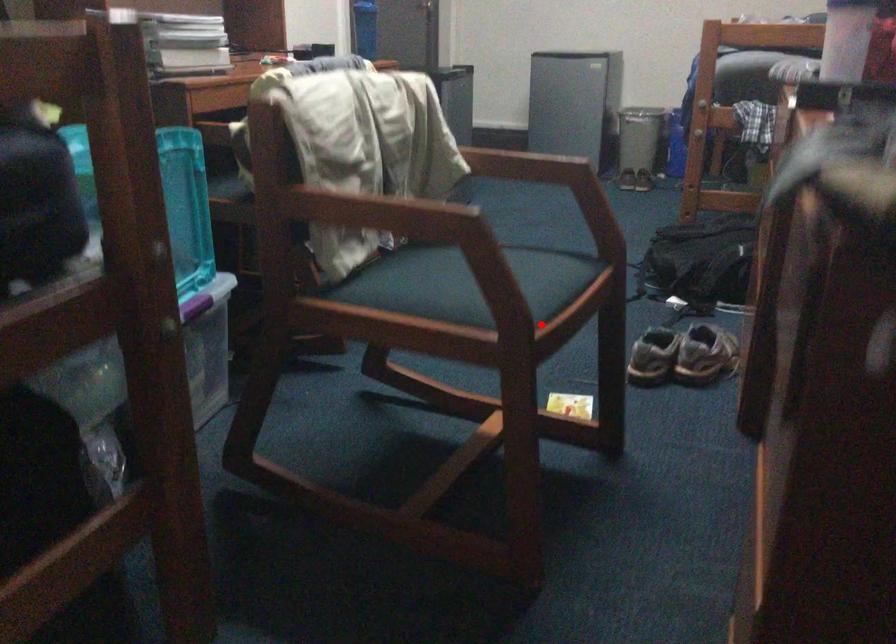
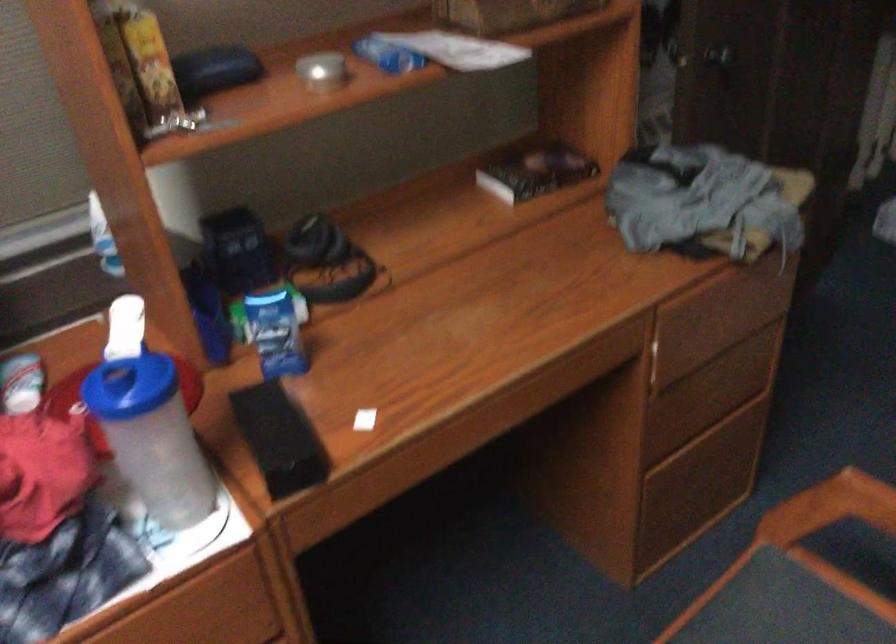
Question: A red point is marked in image1. In image2, is the corresponding 3D point closer to the camera or farther? Reply with the corresponding letter.

Choices:
 (A) The corresponding 3D point is closer.
 (B) The corresponding 3D point is farther.

Answer: (A)